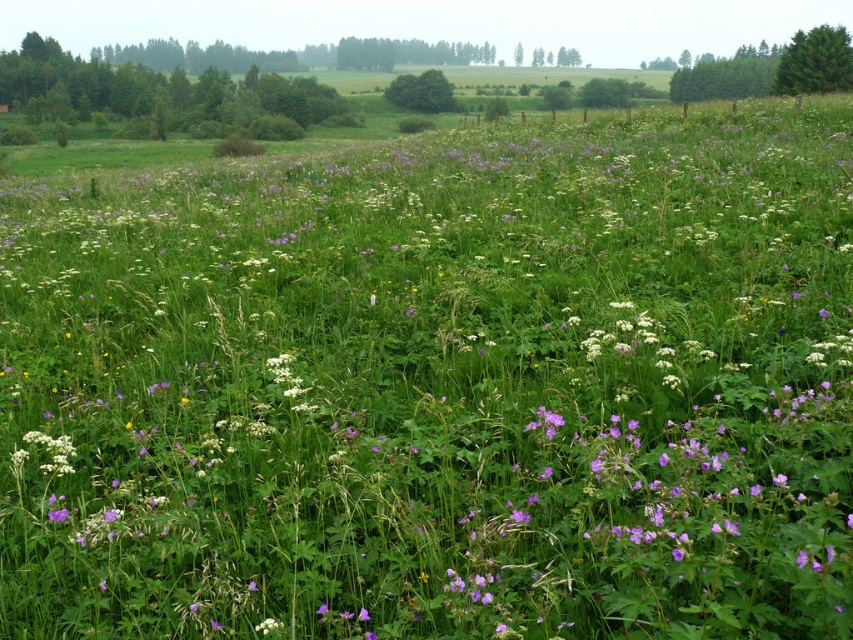
Question: From the image, what is the correct spatial relationship of green matte tree at upper right in relation to green leafy tree at center?

Choices:
 (A) below
 (B) above

Answer: (A)

Question: Is green matte tree at upper right behind green leafy tree at center?

Choices:
 (A) no
 (B) yes

Answer: (A)

Question: Which point is closer to the camera?

Choices:
 (A) green matte tree at upper right
 (B) green leafy tree at center

Answer: (A)

Question: Can you confirm if green matte tree at upper right is positioned to the right of green leafy tree at center?

Choices:
 (A) yes
 (B) no

Answer: (A)